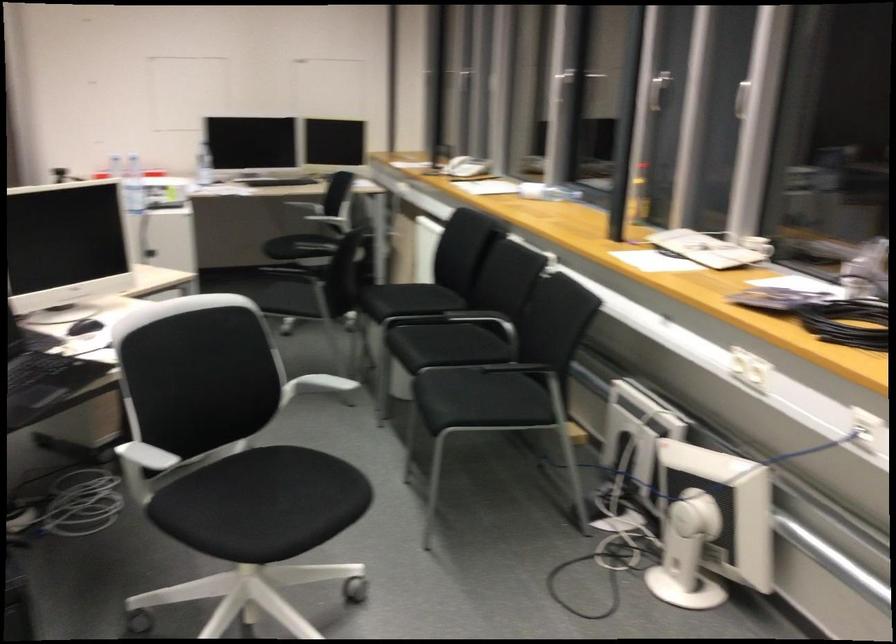
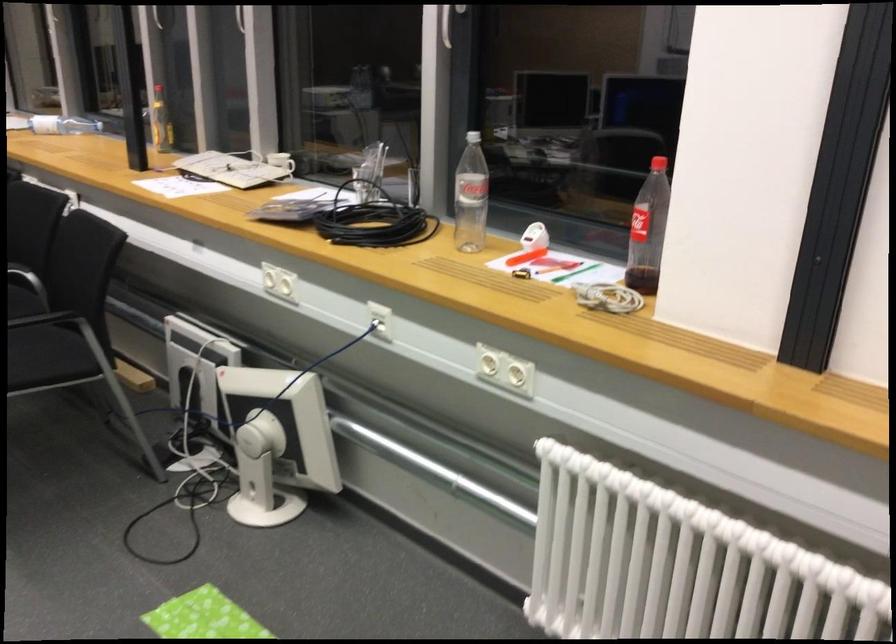
Question: How did the camera likely rotate?

Choices:
 (A) Left
 (B) Right
 (C) Up
 (D) Down

Answer: (B)